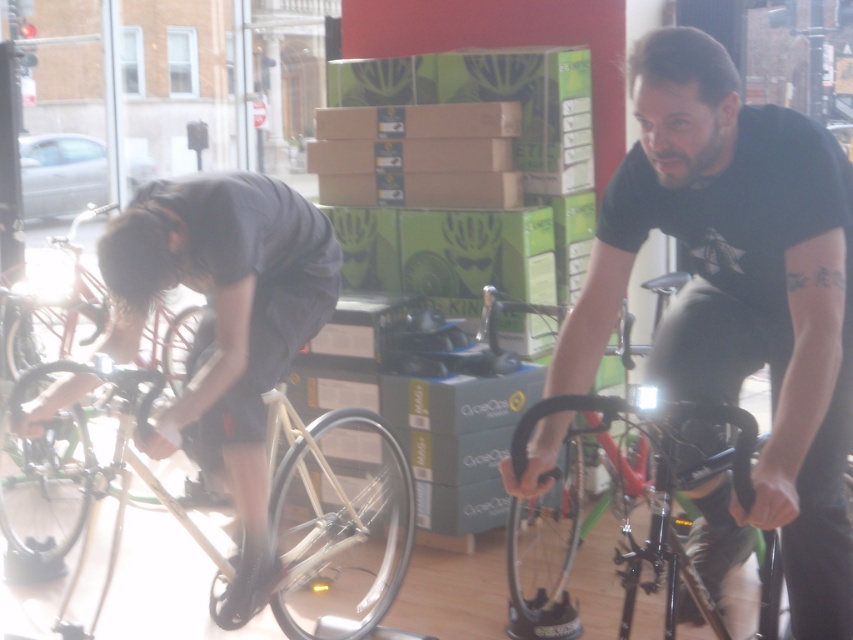
Is point (6, 497) closer to camera compared to point (173, 355)?

Yes, point (6, 497) is in front of point (173, 355).

Between point (68, 515) and point (32, 292), which one is positioned in front?

Point (68, 515) is more forward.

Which is behind, point (74, 499) or point (190, 310)?

Point (190, 310)

Locate an element on the screen. The image size is (853, 640). shiny silver rim at lower left is located at coordinates (48, 497).

Is dark gray fabric shirt at left taller than shiny silver rim at lower left?

Yes.

Is point (218, 323) closer to camera compared to point (18, 577)?

Yes, point (218, 323) is closer to viewer.

Identify the location of dark gray fabric shirt at left. (229, 321).

You are a GUI agent. You are given a task and a screenshot of the screen. Output one action in this format:
    pyautogui.click(x=<x>, y=<y>)
    Task: Click on the black matte shirt at center
    Image resolution: width=853 pixels, height=640 pixels.
    Given the screenshot: What is the action you would take?
    pyautogui.click(x=740, y=304)

Does black matte shirt at center appear over shiny silver tire at lower left?

Actually, black matte shirt at center is below shiny silver tire at lower left.

Image resolution: width=853 pixels, height=640 pixels. Describe the element at coordinates (740, 304) in the screenshot. I see `black matte shirt at center` at that location.

Where is `black matte shirt at center`? black matte shirt at center is located at coordinates (740, 304).